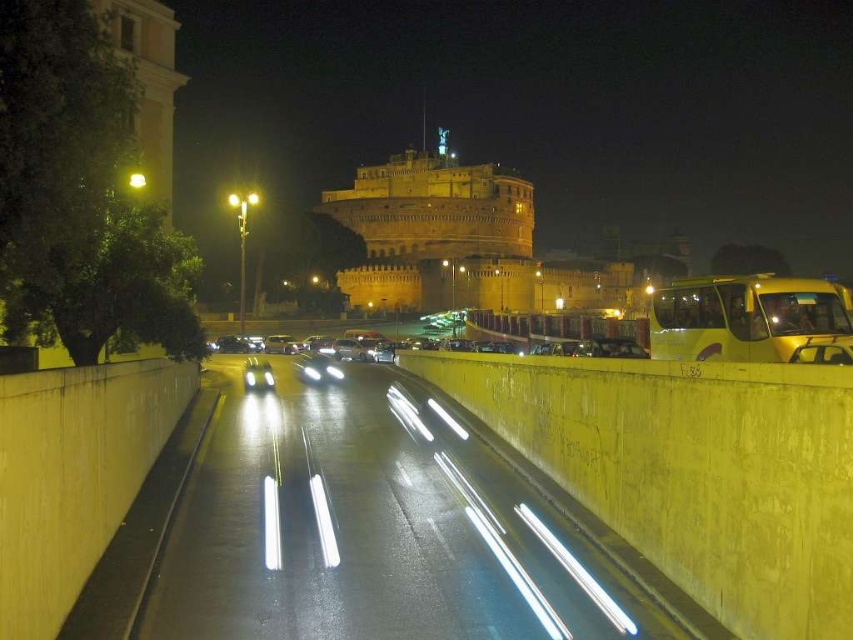
Question: Among these objects, which one is nearest to the camera?

Choices:
 (A) yellow concrete highway at center
 (B) yellow matte bus at right

Answer: (A)

Question: From the image, what is the correct spatial relationship of yellow concrete highway at center in relation to yellow matte bus at right?

Choices:
 (A) below
 (B) above

Answer: (A)

Question: Which point is farther from the camera taking this photo?

Choices:
 (A) (672, 349)
 (B) (363, 444)

Answer: (B)

Question: Is yellow concrete highway at center below yellow matte bus at right?

Choices:
 (A) no
 (B) yes

Answer: (B)

Question: Does yellow concrete highway at center appear under yellow matte bus at right?

Choices:
 (A) no
 (B) yes

Answer: (B)